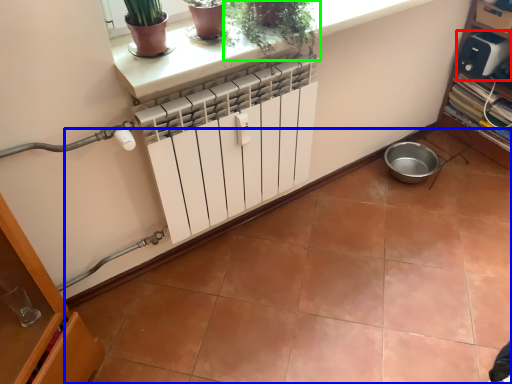
Question: Estimate the real-world distances between objects in this image. Which object is farther from appliance (highlighted by a red box), ceramic tile (highlighted by a blue box) or houseplant (highlighted by a green box)?

Choices:
 (A) ceramic tile
 (B) houseplant

Answer: (B)